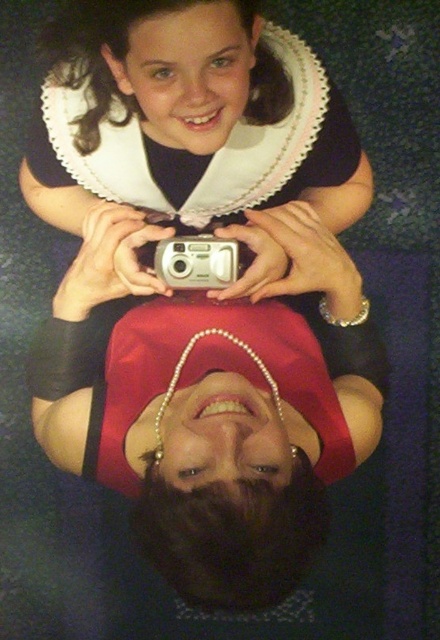
Question: Can you confirm if pearl necklace at center is smaller than silver metallic camera at center?

Choices:
 (A) no
 (B) yes

Answer: (A)

Question: Can you confirm if pearl necklace at center is positioned to the right of silver metallic camera at center?

Choices:
 (A) yes
 (B) no

Answer: (B)

Question: Does pearl necklace at center appear on the right side of silver metallic camera at center?

Choices:
 (A) no
 (B) yes

Answer: (A)

Question: Which of the following is the farthest from the observer?

Choices:
 (A) silver metallic camera at center
 (B) pearl necklace at center

Answer: (A)

Question: Which point is farther from the camera taking this photo?

Choices:
 (A) (171, 474)
 (B) (168, 243)

Answer: (B)